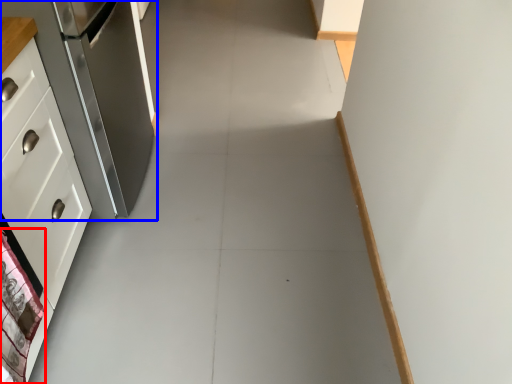
Question: Which point is further to the camera, material (highlighted by a red box) or refrigerator (highlighted by a blue box)?

Choices:
 (A) material
 (B) refrigerator

Answer: (B)